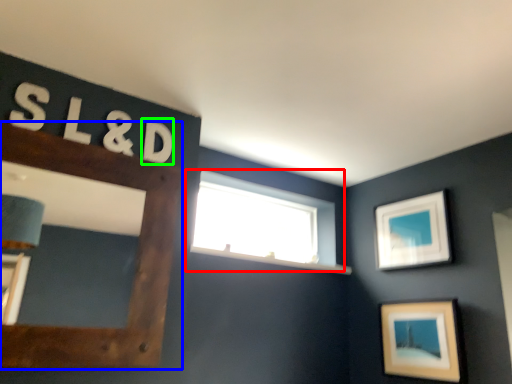
Question: Considering the real-world distances, which object is closest to window (highlighted by a red box)? picture frame (highlighted by a blue box) or letter (highlighted by a green box).

Choices:
 (A) picture frame
 (B) letter

Answer: (A)